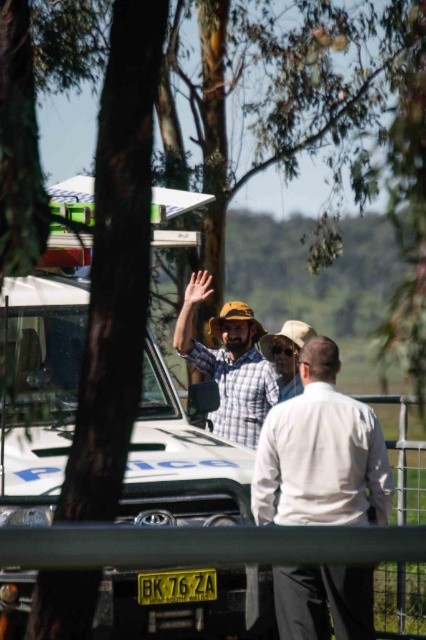
Can you confirm if white matte shirt at center is bigger than metallic silver fence at lower center?

Correct, white matte shirt at center is larger in size than metallic silver fence at lower center.

Between point (324, 384) and point (19, 579), which one is positioned in front?

Point (19, 579) is more forward.

Find the location of `white matte shirt at center`. white matte shirt at center is located at coordinates (321, 452).

Can you confirm if white matte police car at center is wider than yellow matte license plate at center?

Yes, white matte police car at center is wider than yellow matte license plate at center.

Image resolution: width=426 pixels, height=640 pixels. Identify the location of white matte police car at center. (39, 380).

Is white matte shirt at center taller than yellow matte license plate at center?

Indeed, white matte shirt at center has a greater height compared to yellow matte license plate at center.

Who is more forward, [276,611] or [215,576]?

Point [215,576] is in front.

In order to click on white matte shirt at center in this screenshot , I will do `click(321, 452)`.